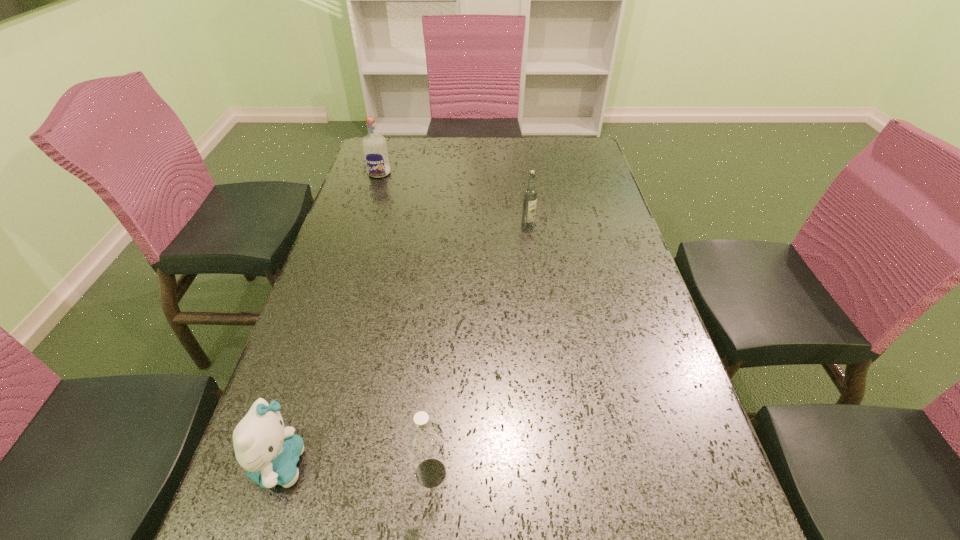
Identify the location of free space located 0.390m on the face of the shortest object. This screenshot has height=540, width=960. (529, 464).

At what (x,y) coordinates should I click in order to perform the action: click on object situated at the far edge. Please return your answer as a coordinate pair (x, y). This screenshot has height=540, width=960. Looking at the image, I should click on 374,145.

The height and width of the screenshot is (540, 960). I want to click on vodka at the left edge, so click(374, 145).

Where is `kitten at the left edge`? This screenshot has width=960, height=540. kitten at the left edge is located at coordinates (269, 452).

The height and width of the screenshot is (540, 960). I want to click on object located in the far left corner section of the desktop, so click(x=374, y=145).

You are a GUI agent. You are given a task and a screenshot of the screen. Output one action in this format:
    pyautogui.click(x=<x>, y=<y>)
    Task: Click on the vacant space at the far edge of the desktop
    
    Given the screenshot: What is the action you would take?
    pyautogui.click(x=472, y=137)

In the image, there is a desktop. Identify the location of free space at the left edge. The width and height of the screenshot is (960, 540). (310, 403).

In the image, there is a desktop. Identify the location of vacant region at the right edge. (668, 379).

Identify the location of vacant space at the far left corner. Image resolution: width=960 pixels, height=540 pixels. (366, 168).

Image resolution: width=960 pixels, height=540 pixels. In order to click on vacant region at the far right corner of the desktop in this screenshot , I will do `click(573, 150)`.